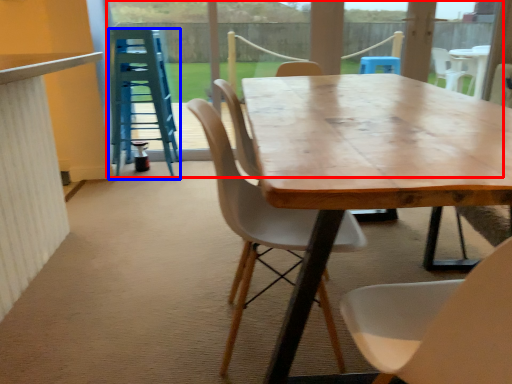
Question: Among these objects, which one is farthest to the camera, glass door (highlighted by a red box) or stool (highlighted by a blue box)?

Choices:
 (A) glass door
 (B) stool

Answer: (A)